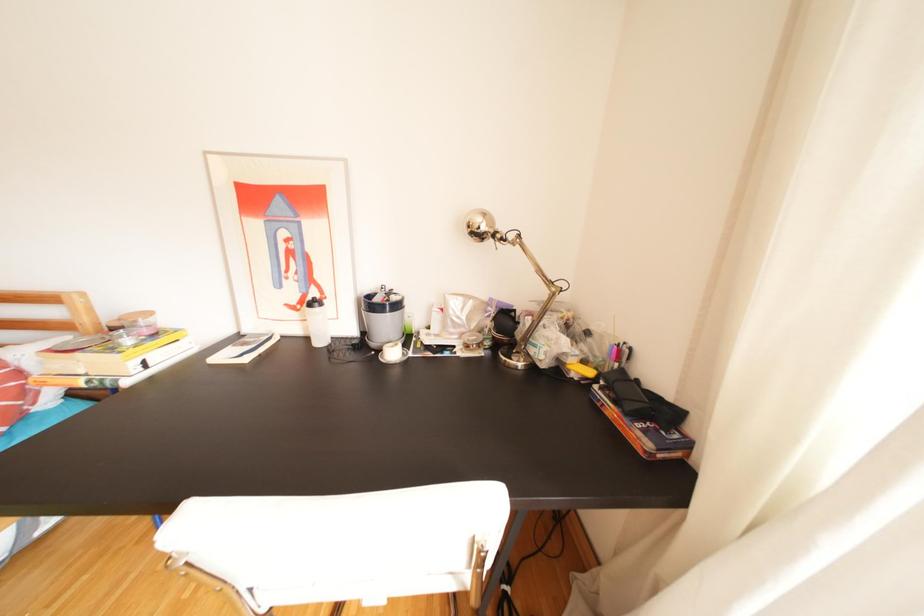
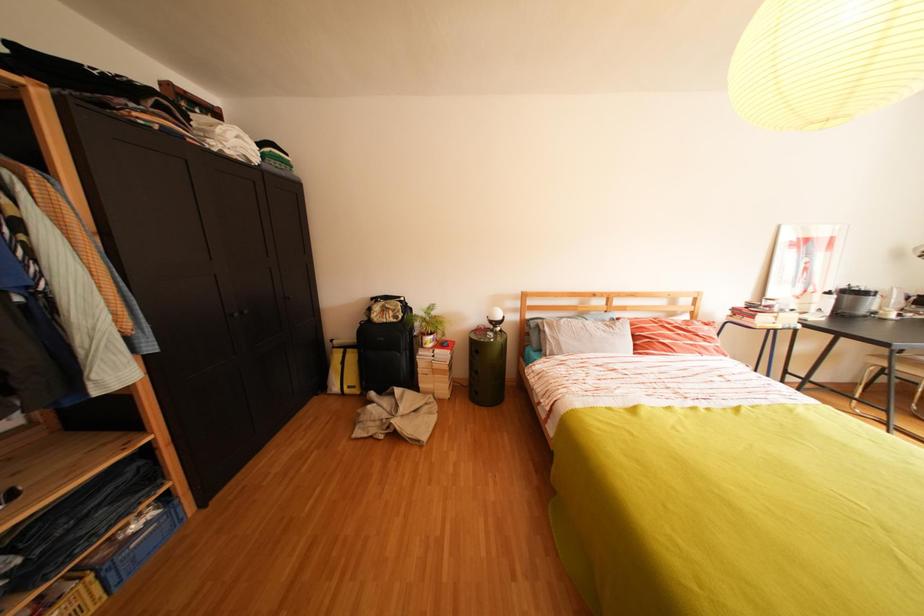
Looking at this image, which direction would the cameraman need to move to produce the second image?

The cameraman walked toward left, backward.